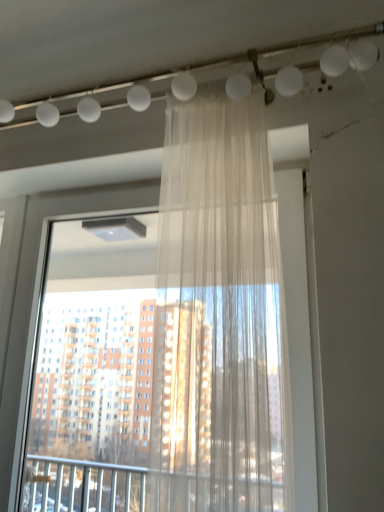
This screenshot has height=512, width=384. What do you see at coordinates (302, 333) in the screenshot?
I see `transparent fabric curtain at center` at bounding box center [302, 333].

Identify the location of transparent fabric curtain at center. This screenshot has width=384, height=512. (302, 333).

Where is `sheer white curtain at center`? This screenshot has width=384, height=512. sheer white curtain at center is located at coordinates (219, 317).

Describe the element at coordinates (219, 317) in the screenshot. I see `sheer white curtain at center` at that location.

Where is `transparent fabric curtain at center`? This screenshot has width=384, height=512. transparent fabric curtain at center is located at coordinates (302, 333).

Which object is positioned more to the right, sheer white curtain at center or transparent fabric curtain at center?

sheer white curtain at center.

Which object is further away from the camera, sheer white curtain at center or transparent fabric curtain at center?

transparent fabric curtain at center is behind.

Does point (245, 463) lie in front of point (49, 213)?

Yes, it is.

From the image's perspective, is sheer white curtain at center above transparent fabric curtain at center?

Yes, from the image's perspective, sheer white curtain at center is over transparent fabric curtain at center.

From a real-world perspective, between sheer white curtain at center and transparent fabric curtain at center, who is vertically higher?

sheer white curtain at center is physically above.

Considering the sizes of sheer white curtain at center and transparent fabric curtain at center in the image, is sheer white curtain at center wider or thinner than transparent fabric curtain at center?

sheer white curtain at center is wider than transparent fabric curtain at center.

Can you confirm if sheer white curtain at center is taller than transparent fabric curtain at center?

Incorrect, the height of sheer white curtain at center is not larger of that of transparent fabric curtain at center.

Which of these two, sheer white curtain at center or transparent fabric curtain at center, is bigger?

transparent fabric curtain at center.

Is transparent fabric curtain at center a part of sheer white curtain at center?

Definitely not — transparent fabric curtain at center is not inside sheer white curtain at center.

Is sheer white curtain at center directly adjacent to transparent fabric curtain at center?

They are not placed beside each other.

Is sheer white curtain at center looking in the opposite direction of transparent fabric curtain at center?

That's right, sheer white curtain at center is facing away from transparent fabric curtain at center.

The width and height of the screenshot is (384, 512). I want to click on window located below the sheer white curtain at center (from the image's perspective), so click(x=302, y=333).

Between transparent fabric curtain at center and sheer white curtain at center, which one appears on the right side from the viewer's perspective?

sheer white curtain at center is more to the right.

Which object is closer to the camera taking this photo, transparent fabric curtain at center or sheer white curtain at center?

sheer white curtain at center is more forward.

Between point (297, 448) and point (156, 440), which one is positioned in front?

Point (156, 440)

From the image's perspective, who appears lower, transparent fabric curtain at center or sheer white curtain at center?

From the image's view, transparent fabric curtain at center is below.

From a real-world perspective, between transparent fabric curtain at center and sheer white curtain at center, who is vertically higher?

sheer white curtain at center is physically above.

Is transparent fabric curtain at center wider or thinner than sheer white curtain at center?

Considering their sizes, transparent fabric curtain at center looks slimmer than sheer white curtain at center.

Can you confirm if transparent fabric curtain at center is taller than sheer white curtain at center?

Indeed, transparent fabric curtain at center has a greater height compared to sheer white curtain at center.

Which of these two, transparent fabric curtain at center or sheer white curtain at center, is smaller?

With smaller size is sheer white curtain at center.

Which is correct: transparent fabric curtain at center is inside sheer white curtain at center, or outside of it?

transparent fabric curtain at center is outside sheer white curtain at center.

Is transparent fabric curtain at center beside sheer white curtain at center?

No, transparent fabric curtain at center is not next to sheer white curtain at center.

Is transparent fabric curtain at center oriented towards sheer white curtain at center?

Yes, transparent fabric curtain at center is aimed at sheer white curtain at center.

Can you tell me how much transparent fabric curtain at center and sheer white curtain at center differ in facing direction?

5.68 degrees separate the facing orientations of transparent fabric curtain at center and sheer white curtain at center.

Find the location of a particular element. curtain above the transparent fabric curtain at center (from the image's perspective) is located at coordinates (219, 317).

This screenshot has height=512, width=384. In order to click on curtain in front of the transparent fabric curtain at center in this screenshot , I will do `click(219, 317)`.

This screenshot has width=384, height=512. I want to click on curtain above the transparent fabric curtain at center (from a real-world perspective), so click(219, 317).